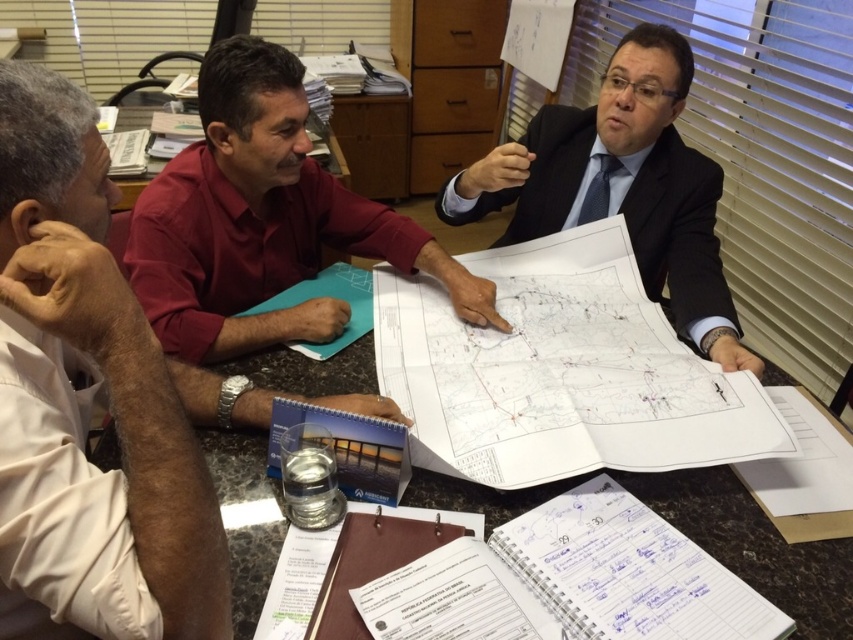
Question: Which object appears farthest from the camera in this image?

Choices:
 (A) clear plastic water at lower center
 (B) dark suit at center
 (C) white paper at center

Answer: (B)

Question: Does white paper at center have a greater width compared to clear plastic water at lower center?

Choices:
 (A) no
 (B) yes

Answer: (A)

Question: Is white shirt at left thinner than matte red shirt at center?

Choices:
 (A) no
 (B) yes

Answer: (B)

Question: Can you confirm if white shirt at left is thinner than clear plastic water at lower center?

Choices:
 (A) yes
 (B) no

Answer: (A)

Question: Which point is farther from the camera taking this photo?

Choices:
 (A) [x=741, y=561]
 (B) [x=599, y=129]
 (C) [x=9, y=186]

Answer: (B)

Question: Which point is closer to the camera?

Choices:
 (A) white paper at center
 (B) dark suit at center
 (C) clear plastic water at lower center

Answer: (C)